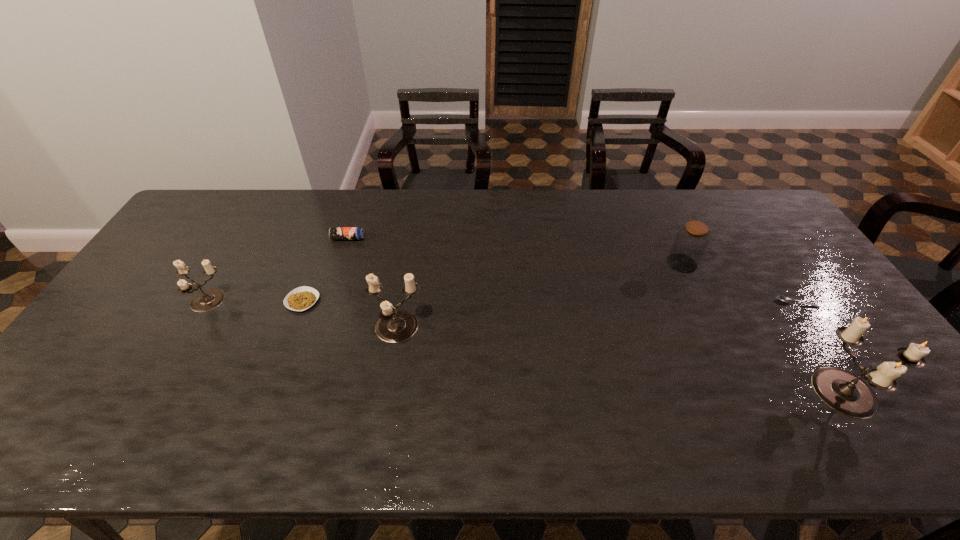
Image resolution: width=960 pixels, height=540 pixels. I want to click on soupspoon, so click(x=782, y=298).

Where is `legume`? This screenshot has height=540, width=960. legume is located at coordinates (301, 298).

Identify the location of vacant space located on the back of the leftmost object. The image size is (960, 540). (249, 231).

Find the location of a particular element. This screenshot has width=960, height=540. vacant space situated 0.360m on the right of the second candle holder from left to right is located at coordinates click(555, 328).

I want to click on free location located on the left of the nearest candle holder, so click(x=785, y=392).

Locate an element on the screen. The width and height of the screenshot is (960, 540). blank area located 0.310m on the left of the beer can is located at coordinates (239, 238).

You are a GUI agent. You are given a task and a screenshot of the screen. Output one action in this format:
    pyautogui.click(x=<x>, y=<y>)
    Task: Click on the vacant space located 0.120m on the left of the jar
    Image resolution: width=960 pixels, height=540 pixels.
    Given the screenshot: What is the action you would take?
    pyautogui.click(x=629, y=263)

Image resolution: width=960 pixels, height=540 pixels. I want to click on vacant space positioned on the left of the shortest object, so click(659, 303).

You are a GUI agent. You are given a task and a screenshot of the screen. Output one action in this format:
    pyautogui.click(x=<x>, y=<y>)
    Task: Click on the free space located 0.070m on the back of the sixth tallest object
    The image size is (960, 540).
    Given the screenshot: What is the action you would take?
    pyautogui.click(x=314, y=272)

You are a GUI agent. You are given a task and a screenshot of the screen. Output one action in this format:
    pyautogui.click(x=<x>, y=<y>)
    Task: Click on the object that is at the near edge
    This screenshot has width=960, height=540.
    Given the screenshot: What is the action you would take?
    pyautogui.click(x=844, y=392)